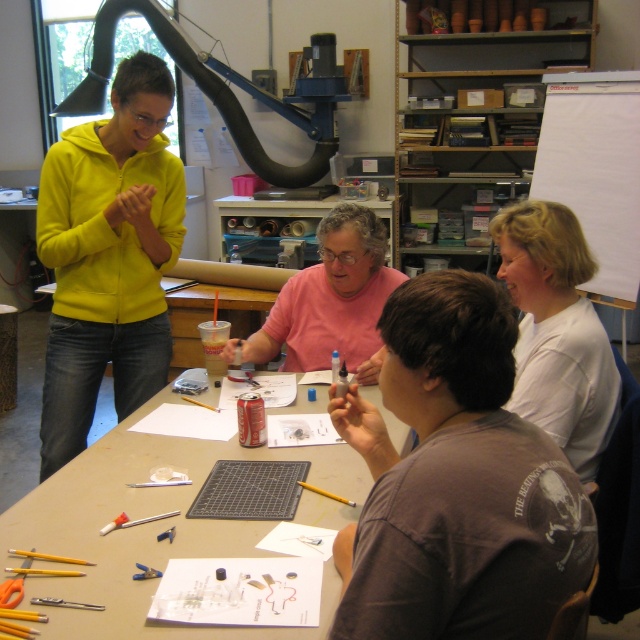
Question: Does matte yellow hoodie at upper left have a lesser width compared to pink cotton shirt at center?

Choices:
 (A) no
 (B) yes

Answer: (B)

Question: Among these objects, which one is farthest from the camera?

Choices:
 (A) dark brown cotton shirt at center
 (B) matte gray cutting mat at center

Answer: (B)

Question: Which point is farther from the camera taking this photo?

Choices:
 (A) (369, 296)
 (B) (132, 161)

Answer: (A)

Question: Does matte yellow hoodie at upper left have a smaller size compared to matte gray cutting mat at center?

Choices:
 (A) no
 (B) yes

Answer: (B)

Question: Among these points, which one is nearest to the camera?

Choices:
 (A) (321, 474)
 (B) (518, 385)

Answer: (A)

Question: Is dark brown cotton shirt at center to the right of white matte shirt at upper right from the viewer's perspective?

Choices:
 (A) yes
 (B) no

Answer: (B)